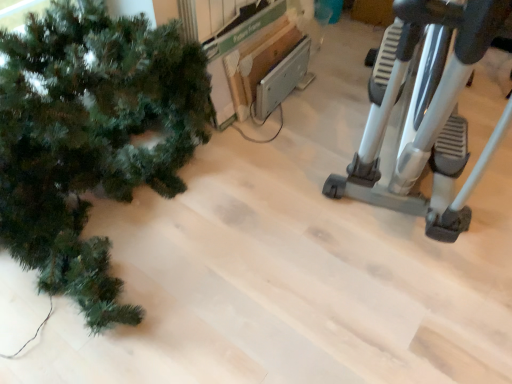
At what (x,y) coordinates should I click in order to perform the action: click on vacant space that is in between silver metallic stationary bicycle at right and green matte christmas tree at left. Please return your answer as a coordinate pair (x, y). Looking at the image, I should click on (291, 165).